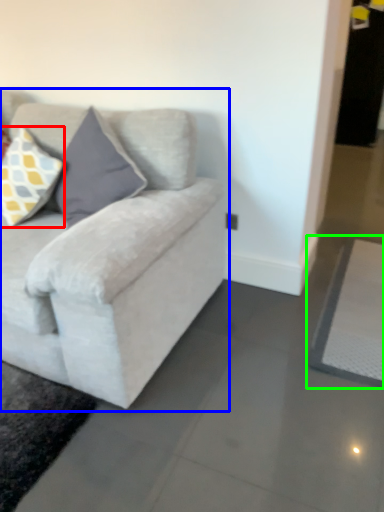
Question: Based on their relative distances, which object is nearer to pillow (highlighted by a red box)? Choose from studio couch (highlighted by a blue box) and yoga mat (highlighted by a green box).

Choices:
 (A) studio couch
 (B) yoga mat

Answer: (A)